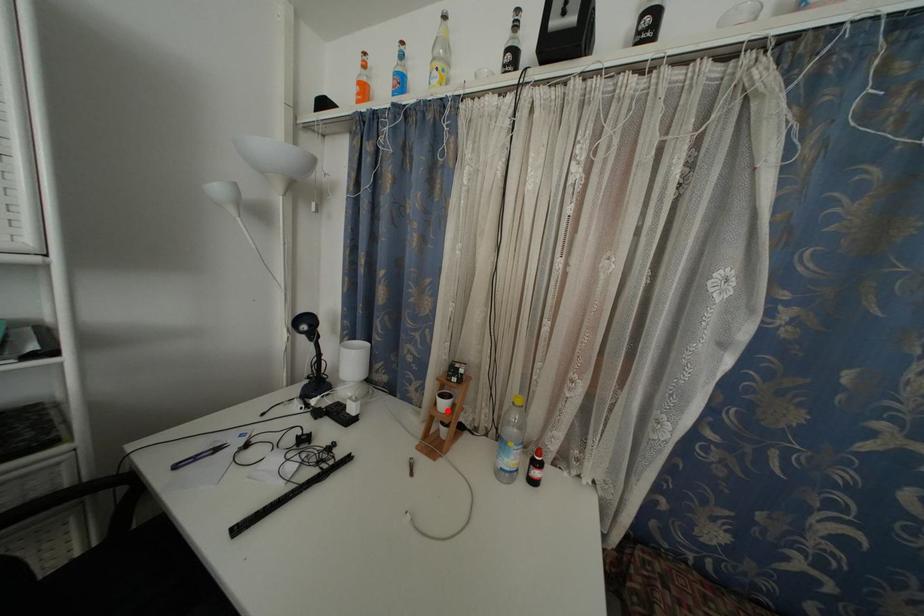
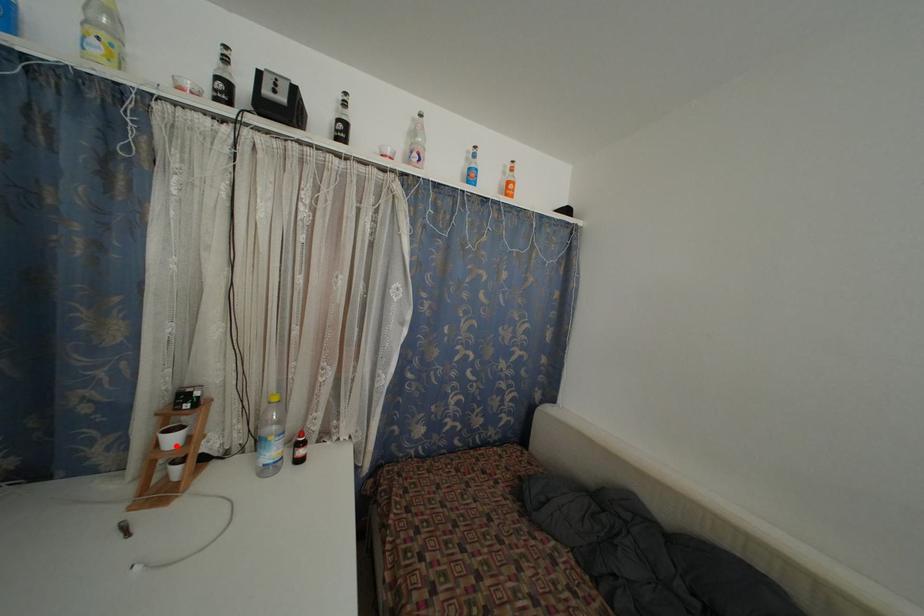
I am providing you with two images of the same scene from different viewpoints. A red point is marked on the first image and another point is marked on the second image. Does the point marked in image1 correspond to the same location as the one in image2?

Yes